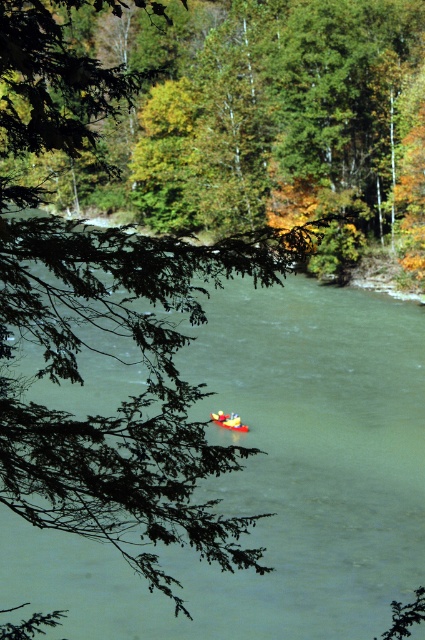
Who is positioned more to the right, yellow plastic kayak at center or bright yellow plastic boat at center?

From the viewer's perspective, bright yellow plastic boat at center appears more on the right side.

Who is higher up, yellow plastic kayak at center or bright yellow plastic boat at center?

yellow plastic kayak at center is higher up.

Which is behind, point (161, 340) or point (212, 420)?

The point (212, 420) is more distant.

The width and height of the screenshot is (425, 640). I want to click on yellow plastic kayak at center, so click(130, 394).